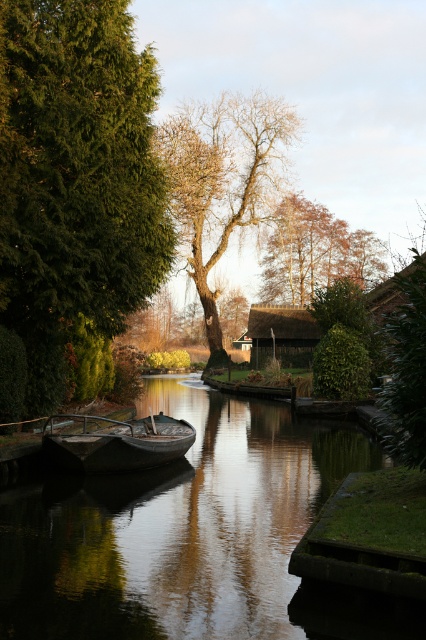
Who is more forward, (126, 28) or (108, 428)?

Point (126, 28) is in front.

Who is shorter, green textured tree at left or wooden boat at center?

With less height is wooden boat at center.

The image size is (426, 640). Describe the element at coordinates (74, 177) in the screenshot. I see `green textured tree at left` at that location.

Locate an element on the screen. This screenshot has width=426, height=640. green textured tree at left is located at coordinates (74, 177).

Is wooden boat at center above thatched wood hut at center?

Incorrect, wooden boat at center is not positioned above thatched wood hut at center.

Is wooden boat at center wider than thatched wood hut at center?

Incorrect, wooden boat at center's width does not surpass thatched wood hut at center's.

I want to click on wooden boat at center, so click(115, 442).

Who is taller, smooth dark water at center or thatched wood hut at center?

thatched wood hut at center

This screenshot has width=426, height=640. Identify the location of smooth dark water at center. (190, 534).